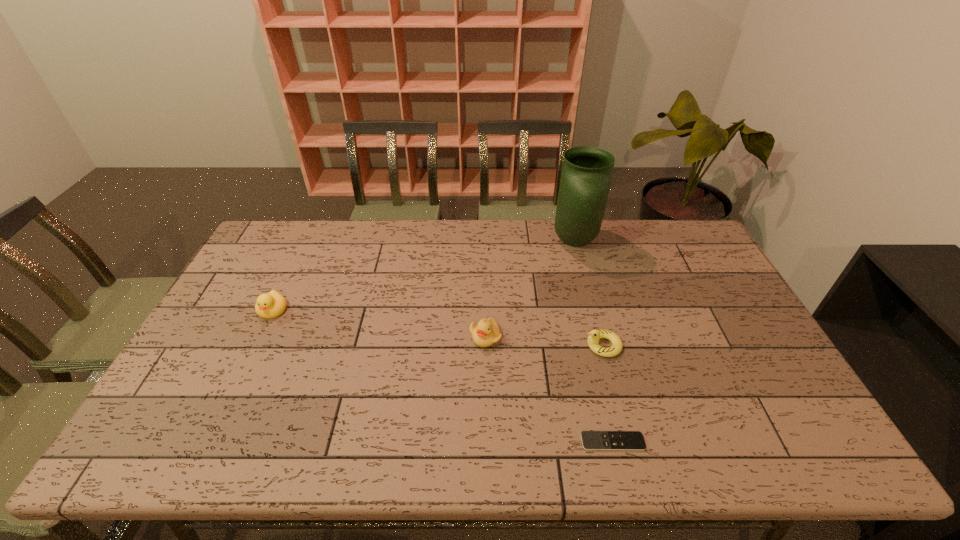
Locate an element on the screen. This screenshot has height=540, width=960. free spot between the leftmost object and the tallest object is located at coordinates (423, 275).

You are a GUI agent. You are given a task and a screenshot of the screen. Output one action in this format:
    pyautogui.click(x=<x>, y=<y>)
    Task: Click on the free space between the second object from left to right and the shortest object
    Image resolution: width=960 pixels, height=540 pixels.
    Given the screenshot: What is the action you would take?
    pyautogui.click(x=549, y=389)

Image resolution: width=960 pixels, height=540 pixels. Identify the location of free point between the second farthest object and the second duckling from left to right. (379, 323).

Where is `empty space between the shortest object and the fourth object from right to left`? empty space between the shortest object and the fourth object from right to left is located at coordinates (549, 389).

The width and height of the screenshot is (960, 540). What are the coordinates of `vacant point located between the tallest object and the second duckling from left to right` in the screenshot? It's located at (530, 289).

The width and height of the screenshot is (960, 540). I want to click on the closest object relative to the shortest object, so click(x=595, y=335).

Identify the location of object that ranks as the third closest to the remote control. (586, 174).

Identify which duckling is the nearest to the rightmost duckling. Please provide its 2D coordinates. Your answer should be formatted as a tuple, i.e. [(x, y)], where the tuple contains the x and y coordinates of a point satisfying the conditions above.

[(486, 333)]

Locate which duckling ranks in proximity to the second duckling from left to right. Please provide its 2D coordinates. Your answer should be formatted as a tuple, i.e. [(x, y)], where the tuple contains the x and y coordinates of a point satisfying the conditions above.

[(595, 335)]

Locate an element on the screen. The image size is (960, 540). free point that satisfies the following two spatial constraints: 1. on the face of the shortest object; 2. on the right side of the second farthest object is located at coordinates (208, 442).